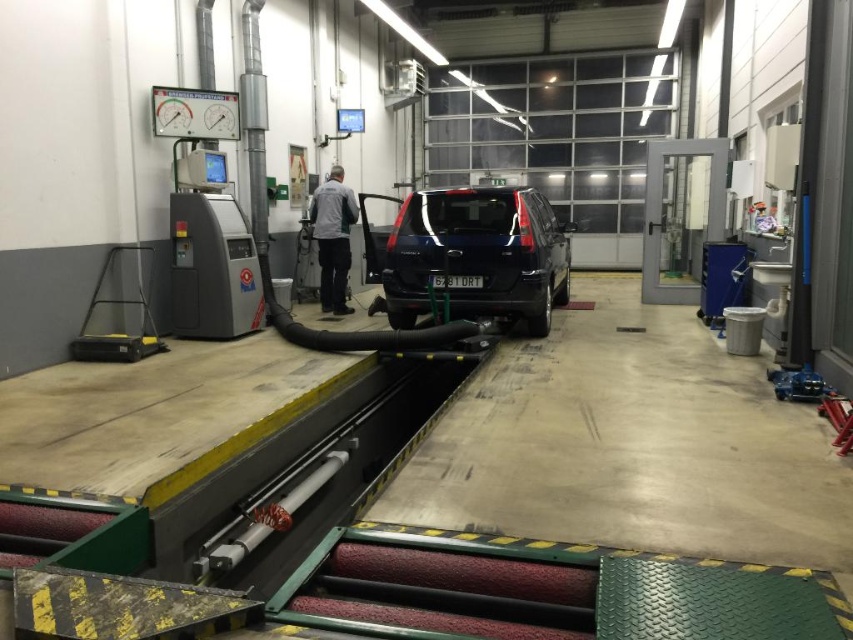
What do you see at coordinates (474, 257) in the screenshot? I see `glossy black suv at center` at bounding box center [474, 257].

Can you confirm if glossy black suv at center is positioned below gray fabric jacket at center?

Yes, glossy black suv at center is below gray fabric jacket at center.

Does point (521, 307) come in front of point (332, 195)?

That is True.

Image resolution: width=853 pixels, height=640 pixels. I want to click on glossy black suv at center, so click(x=474, y=257).